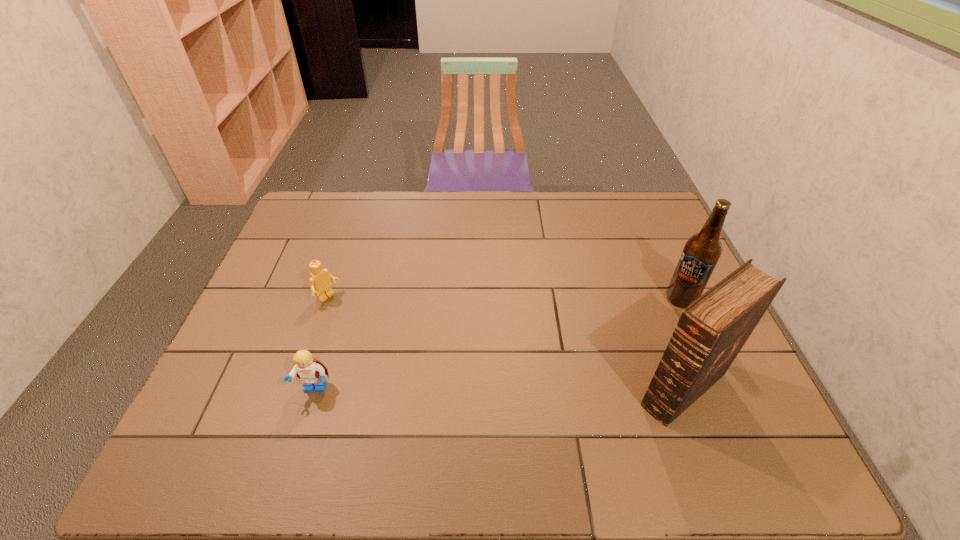
In order to click on free space on the desktop that is between the nearer Lego and the Bible and is positioned on the label of the beer bottle in this screenshot , I will do `click(548, 389)`.

Find the location of a particular element. vacant spot on the desktop that is between the nearer Lego and the Bible and is positioned on the face of the farther Lego is located at coordinates (450, 389).